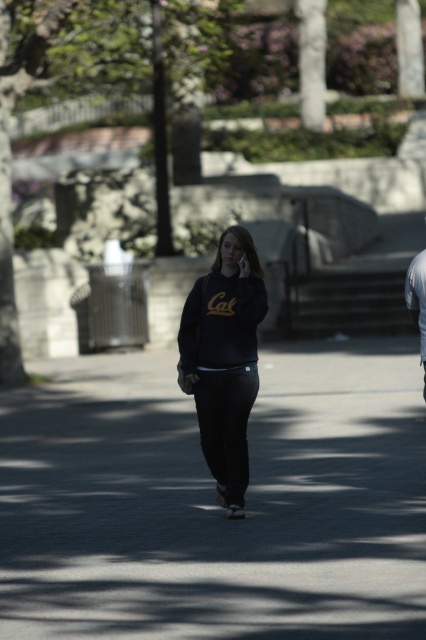
Is the position of dark blue fleece sweatshirt at center less distant than that of dark gray hoodie at center?

Yes, it is.

Is dark blue fleece sweatshirt at center wider than dark gray hoodie at center?

No.

Between point (195, 333) and point (414, 280), which one is positioned in front?

Point (195, 333)

Locate an element on the screen. This screenshot has height=640, width=426. dark blue fleece sweatshirt at center is located at coordinates (221, 323).

Does dark gray hoodie at center appear under black matte phone at center?

Indeed, dark gray hoodie at center is positioned under black matte phone at center.

Can you confirm if dark gray hoodie at center is shorter than black matte phone at center?

No.

Between point (408, 312) and point (245, 260), which one is positioned in front?

Point (245, 260) is more forward.

What are the coordinates of `dark gray hoodie at center` in the screenshot? It's located at (417, 301).

Is dark blue fleece sweatshirt at center positioned before black matte phone at center?

That is True.

Is dark blue fleece sweatshirt at center wider than black matte phone at center?

Yes, dark blue fleece sweatshirt at center is wider than black matte phone at center.

Where is `dark blue fleece sweatshirt at center`? This screenshot has width=426, height=640. dark blue fleece sweatshirt at center is located at coordinates (221, 323).